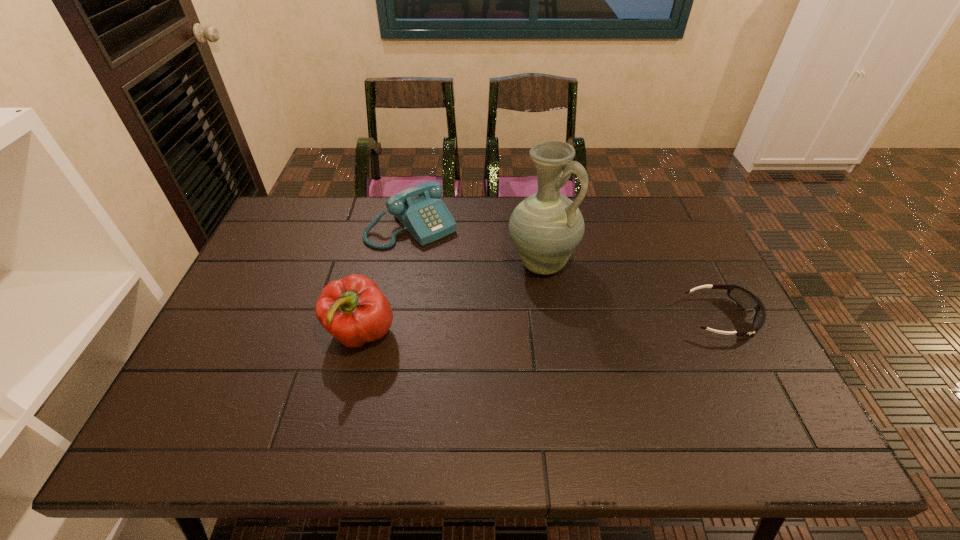
You are a GUI agent. You are given a task and a screenshot of the screen. Output one action in this format:
    pyautogui.click(x=<x>, y=<y>)
    Task: Click on the vacant space on the desktop that is between the bell pepper and the goggles and is positioned on the handle side of the tallest object
    The height and width of the screenshot is (540, 960).
    Given the screenshot: What is the action you would take?
    pyautogui.click(x=593, y=323)

Where is `vacant space on the desktop that is between the bell pepper and the goggles and is positioned on the dial of the second shortest object`? This screenshot has height=540, width=960. vacant space on the desktop that is between the bell pepper and the goggles and is positioned on the dial of the second shortest object is located at coordinates (510, 327).